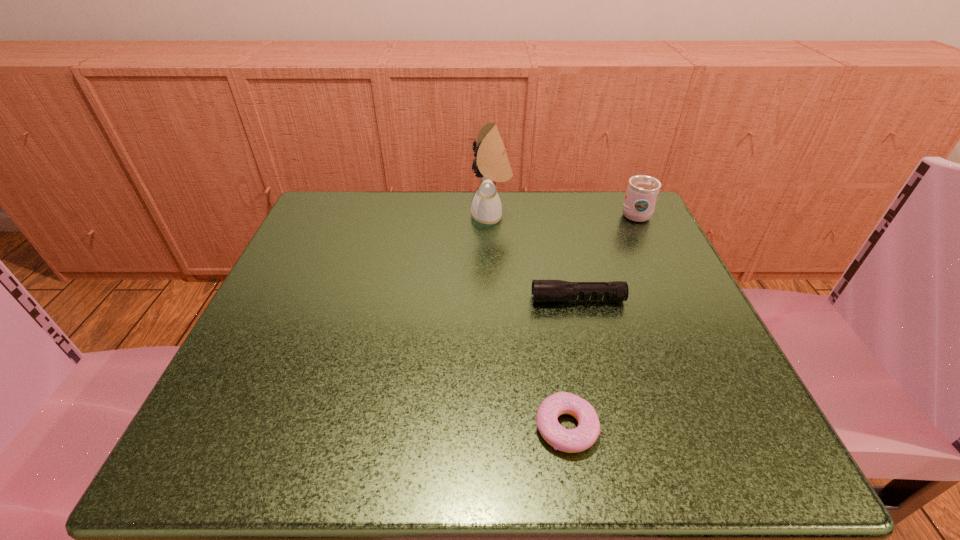
What are the coordinates of `object that can be found as the third closest to the cup` in the screenshot? It's located at (579, 439).

At what (x,y) coordinates should I click in order to perform the action: click on object that stands as the second closest to the cup. Please return your answer as a coordinate pair (x, y). The image size is (960, 540). Looking at the image, I should click on (493, 166).

Find the location of a particular element. This screenshot has height=540, width=960. vacant space that satisfies the following two spatial constraints: 1. at the lens end of the flashlight; 2. on the front side of the shortest object is located at coordinates (609, 428).

Where is `vacant area that satisfies the following two spatial constraints: 1. at the front face of the tallest object; 2. on the left side of the shortest object`? This screenshot has height=540, width=960. vacant area that satisfies the following two spatial constraints: 1. at the front face of the tallest object; 2. on the left side of the shortest object is located at coordinates (497, 428).

This screenshot has height=540, width=960. I want to click on blank area in the image that satisfies the following two spatial constraints: 1. on the back side of the doughnut; 2. at the front face of the tallest object, so click(x=532, y=217).

This screenshot has width=960, height=540. In order to click on free space that satisfies the following two spatial constraints: 1. at the front face of the doll; 2. on the back side of the doughnut in this screenshot , I will do `click(497, 428)`.